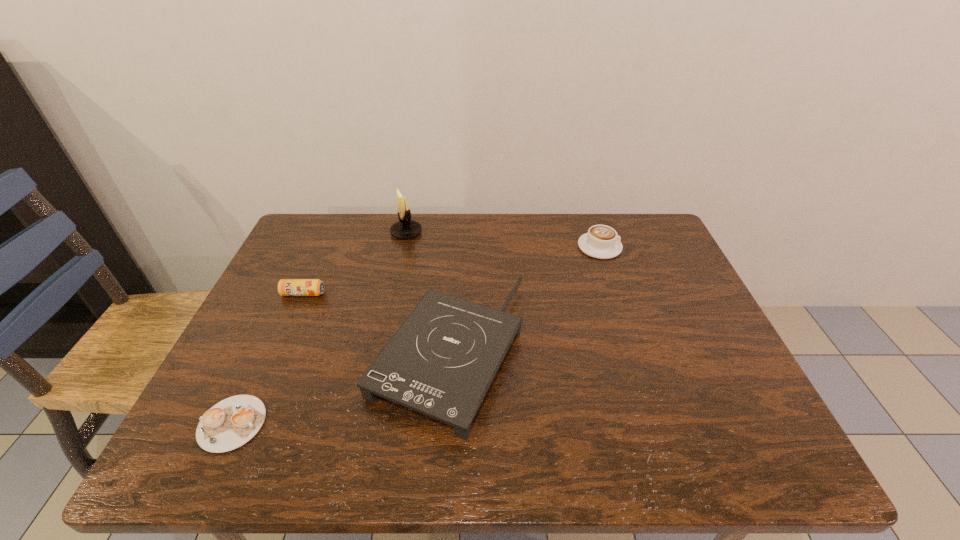
Find the location of a particular element. The width and height of the screenshot is (960, 540). vacant space located 0.130m on the right of the nearer cappuccino is located at coordinates (327, 423).

At what (x,y) coordinates should I click in order to perform the action: click on candle holder situated at the far edge. Please return your answer as a coordinate pair (x, y). Looking at the image, I should click on (405, 228).

The width and height of the screenshot is (960, 540). Identify the location of cappuccino located in the far edge section of the desktop. (601, 241).

The image size is (960, 540). In order to click on hotplate present at the near edge in this screenshot , I will do `click(442, 360)`.

At what (x,y) coordinates should I click in order to perform the action: click on cappuccino located in the near edge section of the desktop. Please return your answer as a coordinate pair (x, y). The height and width of the screenshot is (540, 960). Looking at the image, I should click on (232, 422).

Where is `beer can at the left edge`? The width and height of the screenshot is (960, 540). beer can at the left edge is located at coordinates (286, 287).

Locate an element on the screen. cappuccino that is at the left edge is located at coordinates 232,422.

Locate an element on the screen. The image size is (960, 540). object that is positioned at the right edge is located at coordinates (601, 241).

Where is `object that is at the near left corner`? The width and height of the screenshot is (960, 540). object that is at the near left corner is located at coordinates (232, 422).

Where is `object positioned at the far right corner`? The image size is (960, 540). object positioned at the far right corner is located at coordinates (601, 241).